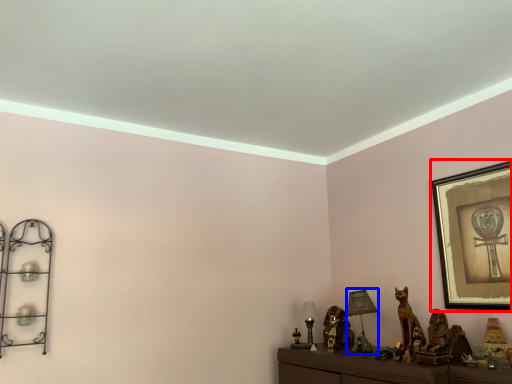
Question: Among these objects, which one is farthest to the camera, picture frame (highlighted by a red box) or table lamp (highlighted by a blue box)?

Choices:
 (A) picture frame
 (B) table lamp

Answer: (B)